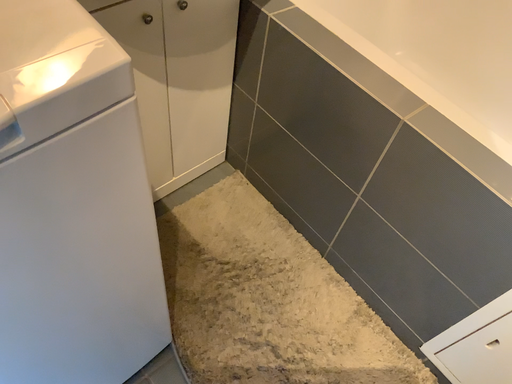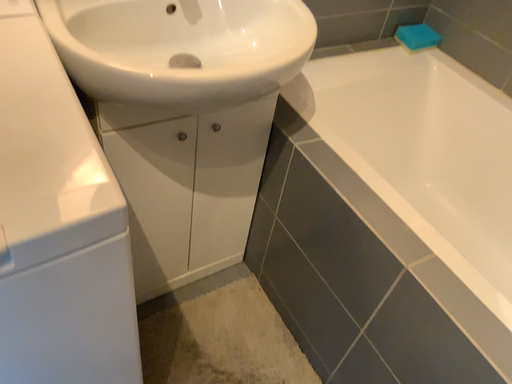
Question: How did the camera likely rotate when shooting the video?

Choices:
 (A) rotated upward
 (B) rotated downward

Answer: (A)